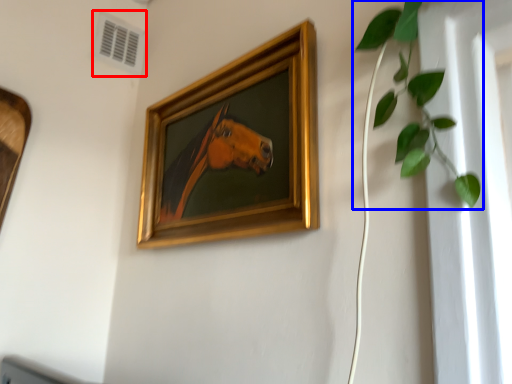
Question: Which of the following is the farthest to the observer, air conditioning (highlighted by a red box) or houseplant (highlighted by a blue box)?

Choices:
 (A) air conditioning
 (B) houseplant

Answer: (A)